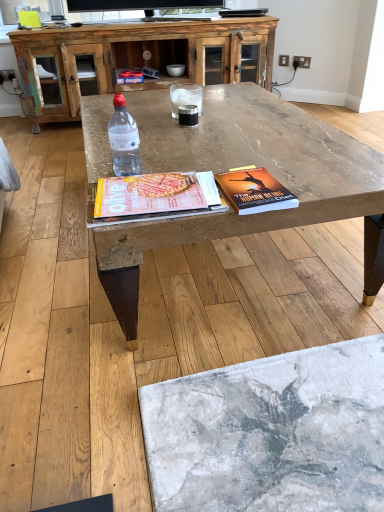
Locate an element on the screen. Image resolution: width=384 pixels, height=512 pixels. vacant space underneath marble textured coffee table at center (from a real-world perspective) is located at coordinates (237, 266).